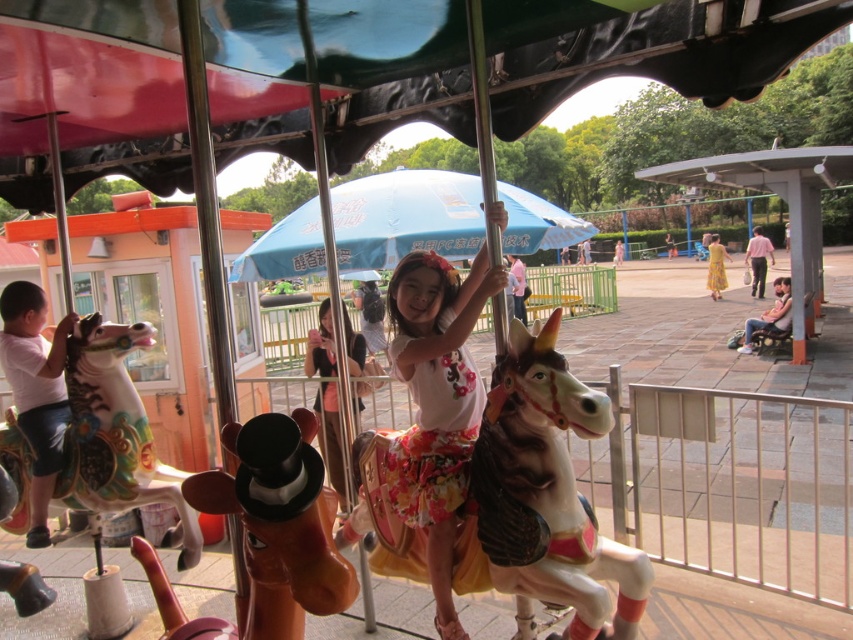
Looking at this image, you are a parent trying to choose between two carousel horses for your child. The white glossy horse at center and the painted wood horse at left are available. Based on size, which one would you choose if your child prefers a bigger horse?

The white glossy horse at center is larger in size than the painted wood horse at left, so you should choose the white glossy horse at center for your child if they prefer a bigger horse.

You are a photographer trying to capture a clear photo of both the white glossy horse at center and the floral cotton dress at center. Which object should you focus on first to ensure it appears larger in the photo?

The white glossy horse at center is bigger than the floral cotton dress at center, so you should focus on the white glossy horse at center first to ensure it appears larger in the photo.